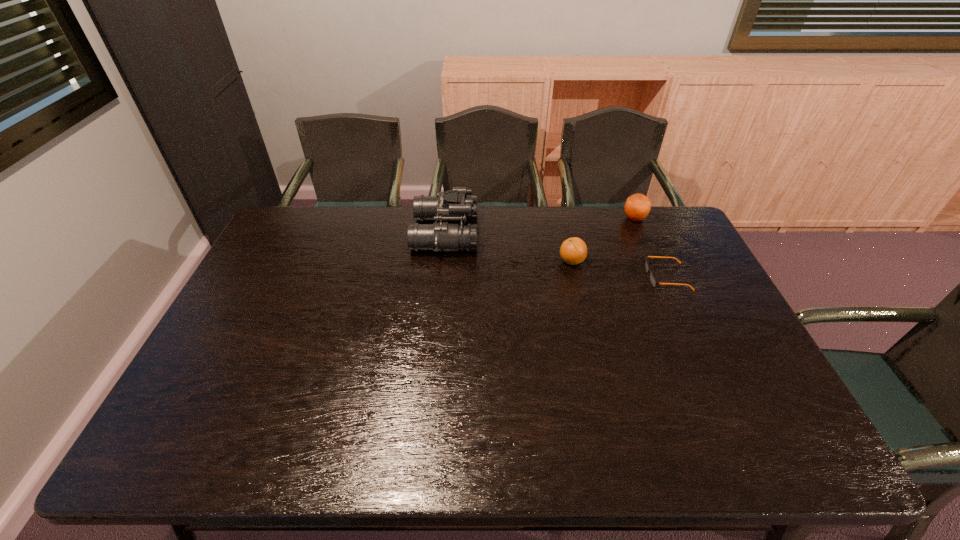
This screenshot has height=540, width=960. Identify the location of binoculars. coord(454,205).

Identify the location of the tallest object. Image resolution: width=960 pixels, height=540 pixels. [454, 205].

The height and width of the screenshot is (540, 960). Identify the location of the right orange. (637, 207).

At what (x,y) coordinates should I click in order to perform the action: click on the third tallest object. Please return your answer as a coordinate pair (x, y). The width and height of the screenshot is (960, 540). Looking at the image, I should click on coord(573,250).

At what (x,y) coordinates should I click in order to perform the action: click on the second object from left to right. Please return your answer as a coordinate pair (x, y). Looking at the image, I should click on coord(573,250).

What are the coordinates of `the shortest object` in the screenshot? It's located at (653, 281).

Locate an element on the screen. The image size is (960, 540). free spot located 0.220m through the lenses of the tallest object is located at coordinates (540, 234).

Locate an element on the screen. free space located 0.360m on the front of the farther orange is located at coordinates (669, 298).

This screenshot has height=540, width=960. I want to click on free space located 0.170m on the right of the third object from right to left, so click(x=637, y=261).

Where is `vacant space positioned 0.100m on the front-facing side of the spectacles`? The height and width of the screenshot is (540, 960). vacant space positioned 0.100m on the front-facing side of the spectacles is located at coordinates (614, 277).